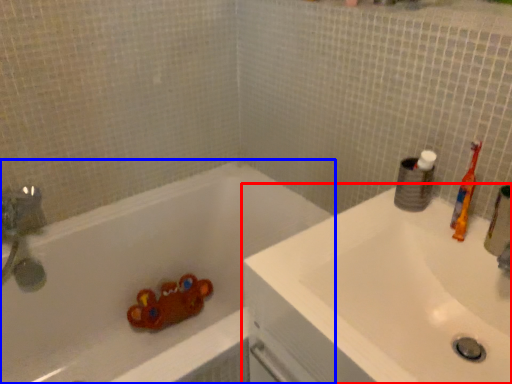
Question: Which point is further to the camera, sink (highlighted by a red box) or bathtub (highlighted by a blue box)?

Choices:
 (A) sink
 (B) bathtub

Answer: (B)